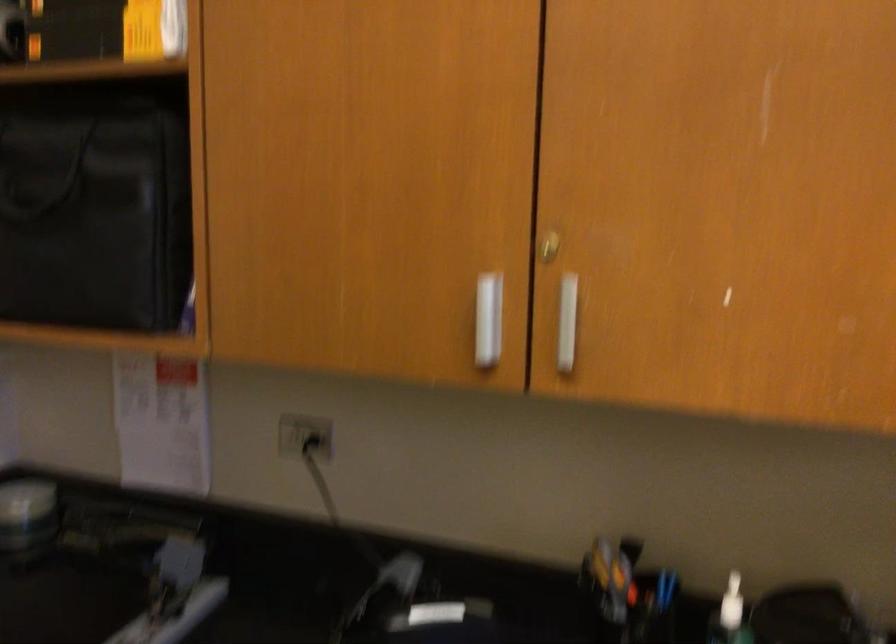
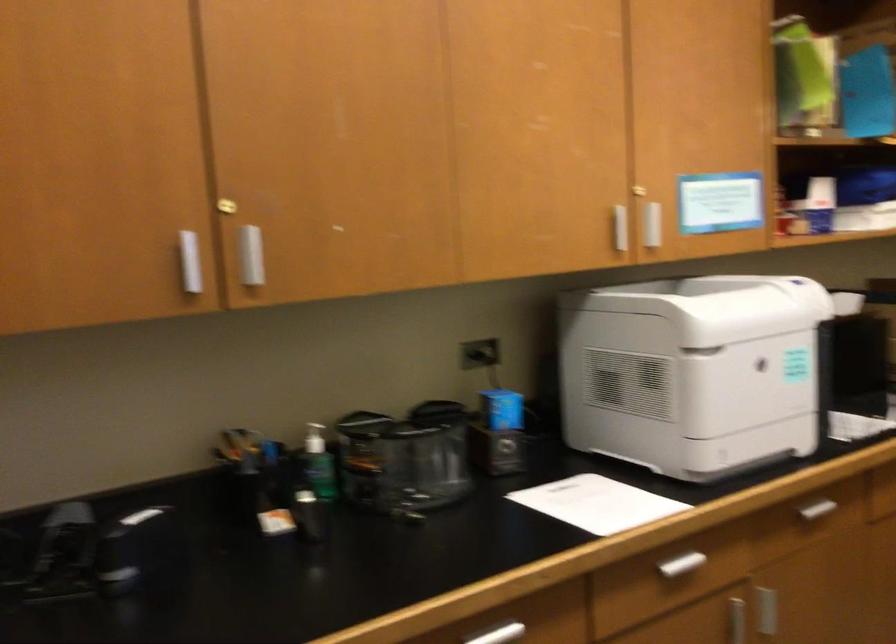
Question: The first image is from the beginning of the video and the second image is from the end. How did the camera likely rotate when shooting the video?

Choices:
 (A) Left
 (B) Right
 (C) Up
 (D) Down

Answer: (B)